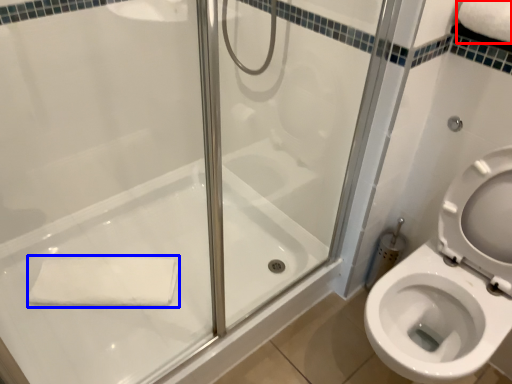
Question: Among these objects, which one is farthest to the camera, bath towel (highlighted by a red box) or bath towel (highlighted by a blue box)?

Choices:
 (A) bath towel
 (B) bath towel

Answer: (B)